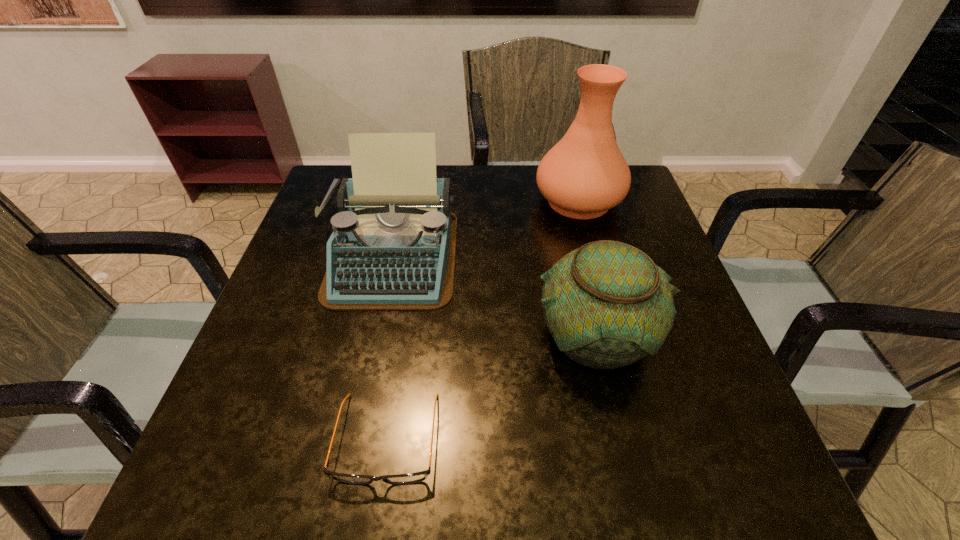
I want to click on free space that satisfies the following two spatial constraints: 1. on the typing side of the typewriter; 2. on the left side of the third tallest object, so click(x=375, y=336).

Identify the location of free space that satisfies the following two spatial constraints: 1. on the typing side of the typewriter; 2. on the left side of the pottery. (375, 336).

Where is `vacant region that satisfies the following two spatial constraints: 1. on the typing side of the typewriter; 2. on the left side of the pottery`? The width and height of the screenshot is (960, 540). vacant region that satisfies the following two spatial constraints: 1. on the typing side of the typewriter; 2. on the left side of the pottery is located at coordinates (375, 336).